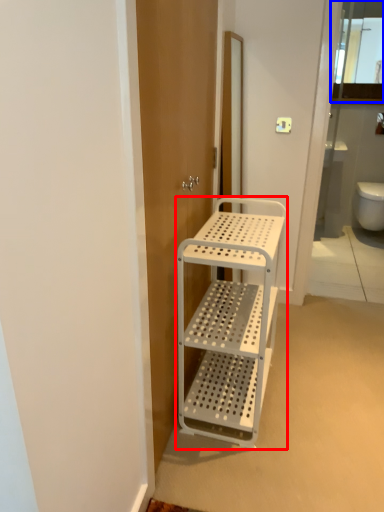
Question: Which of the following is the closest to the observer, furniture (highlighted by a red box) or cabinet (highlighted by a blue box)?

Choices:
 (A) furniture
 (B) cabinet

Answer: (A)